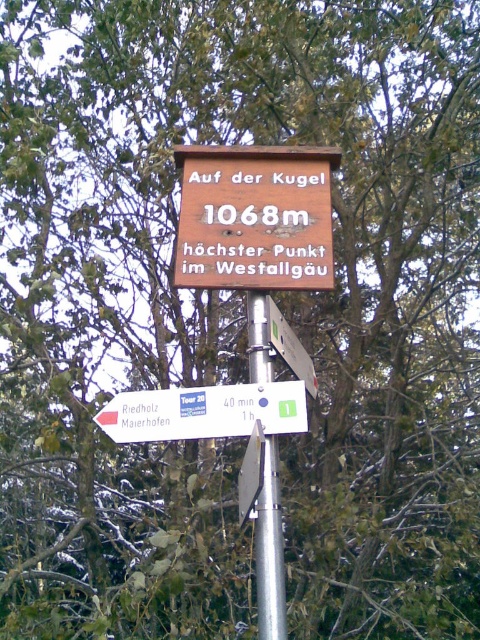
Does point (192, 260) come closer to viewer compared to point (203, 406)?

No, (192, 260) is behind (203, 406).

What are the coordinates of `brown wooden sign at center` in the screenshot? It's located at [254, 218].

You are a GUI agent. You are given a task and a screenshot of the screen. Output one action in this format:
    pyautogui.click(x=<x>, y=<y>)
    Task: Click on the brown wooden sign at center
    
    Given the screenshot: What is the action you would take?
    pyautogui.click(x=254, y=218)

Who is higher up, white plastic sign at lower left or metallic silver sign at center?

metallic silver sign at center

Which of these two, white plastic sign at lower left or metallic silver sign at center, stands shorter?

Standing shorter between the two is white plastic sign at lower left.

At what (x,y) coordinates should I click in order to perform the action: click on white plastic sign at lower left. Please return your answer as a coordinate pair (x, y). The height and width of the screenshot is (640, 480). Looking at the image, I should click on (204, 412).

Consider the image. Is brown wooden sign at center shorter than metallic silver sign at center?

In fact, brown wooden sign at center may be taller than metallic silver sign at center.

Between brown wooden sign at center and metallic silver sign at center, which one has more height?

brown wooden sign at center is taller.

Describe the element at coordinates (254, 218) in the screenshot. The width and height of the screenshot is (480, 640). I see `brown wooden sign at center` at that location.

Identify the location of brown wooden sign at center. (254, 218).